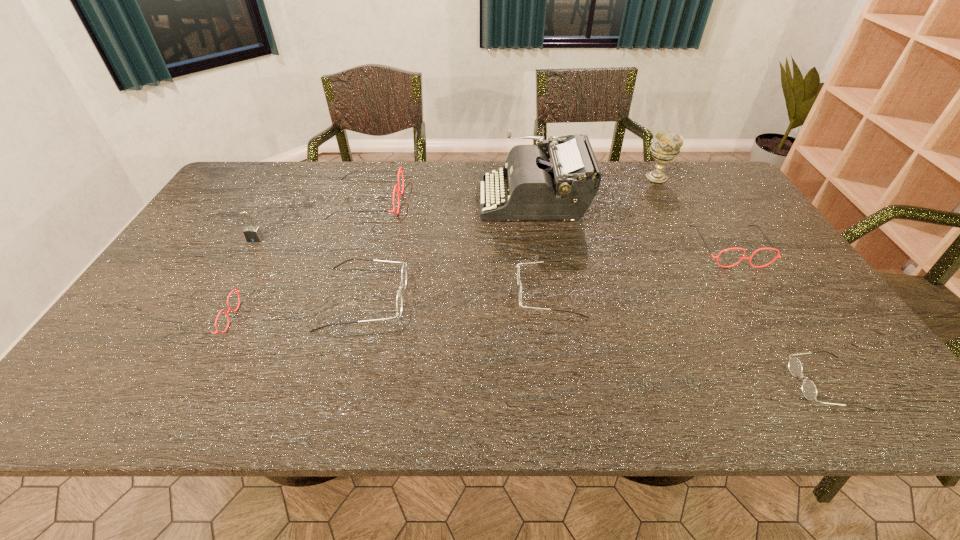
Locate an element on the screen. the fourth spectacles from left to right is located at coordinates (518, 270).

The height and width of the screenshot is (540, 960). What are the coordinates of `the leftmost spectacles` in the screenshot? It's located at (237, 291).

Where is `the smallest red spectacles`? the smallest red spectacles is located at coordinates (237, 291).

Where is `the nearest object`? the nearest object is located at coordinates (809, 390).

The height and width of the screenshot is (540, 960). I want to click on the rightmost dark spectacles, so click(809, 390).

Locate an element on the screen. Image resolution: width=960 pixels, height=540 pixels. vacant area located 0.300m on the front-facing side of the typewriter is located at coordinates (386, 199).

Image resolution: width=960 pixels, height=540 pixels. I want to click on vacant point located on the front-facing side of the typewriter, so click(354, 199).

What are the coordinates of `vacant space located 0.390m on the front-facing side of the typewriter` in the screenshot? It's located at (358, 199).

At what (x,y) coordinates should I click in order to perform the action: click on vacant region located on the left of the eighth shortest object. Please return your answer as a coordinate pair (x, y). This screenshot has width=960, height=540. Looking at the image, I should click on (554, 177).

Find the location of `free spot located 0.370m on the shackle of the gray padlock`. free spot located 0.370m on the shackle of the gray padlock is located at coordinates (193, 348).